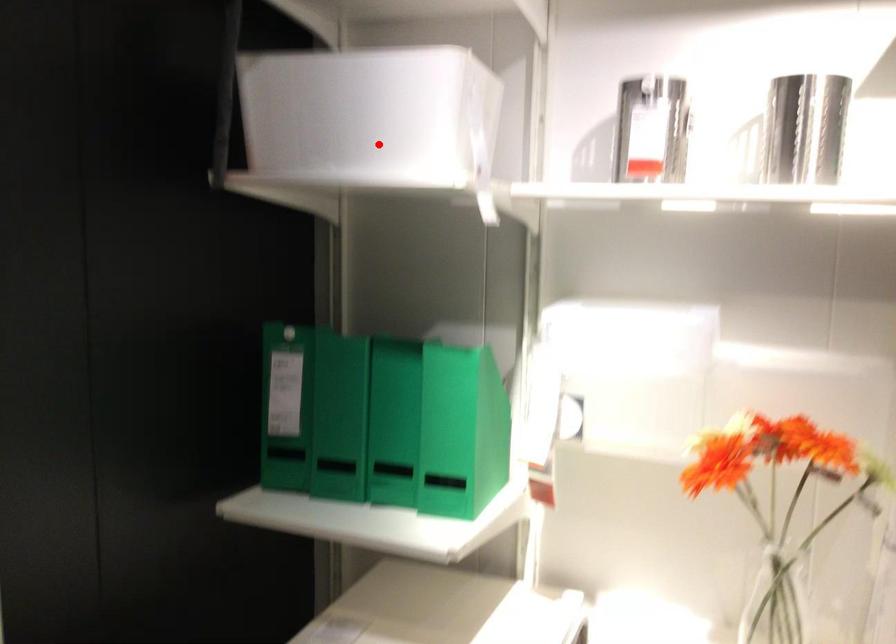
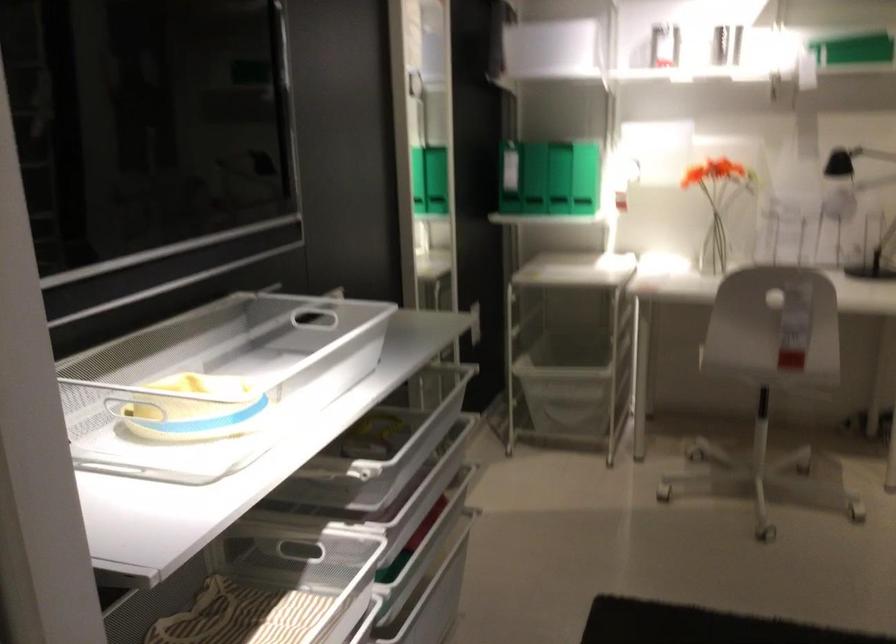
Where in the second image is the point corresponding to the highlighted location from the first image?

(556, 46)